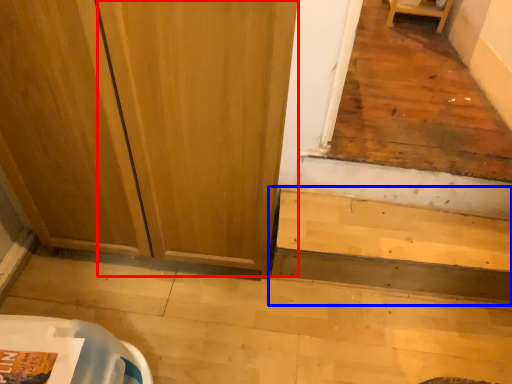
Question: Which point is further to the camera, screen door (highlighted by a red box) or stairwell (highlighted by a blue box)?

Choices:
 (A) screen door
 (B) stairwell

Answer: (B)